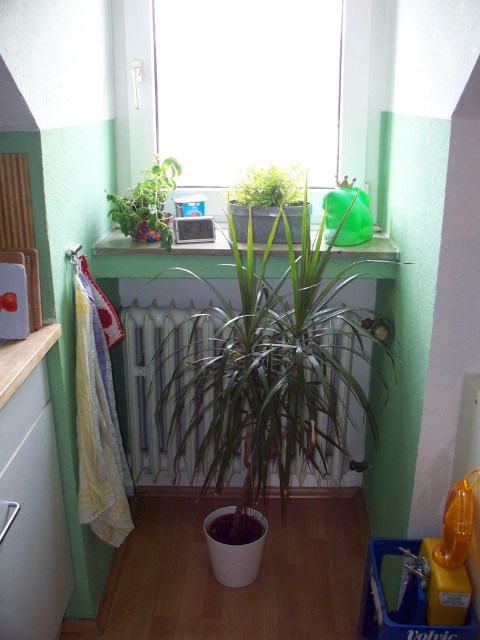
Looking at this image, you are organizing items on the window sill and need to know which object takes up more space. Which one is bigger between the transparent glass window at upper center and the green plastic container at upper center?

The transparent glass window at upper center has a larger size compared to the green plastic container at upper center, so the transparent glass window at upper center takes up more space.

You are standing in the room and want to reach both the point at coordinates point (203, 464) and point (272, 202). Which point is closer to you?

Point (272, 202) is closer to you because it is less further away than point (203, 464).